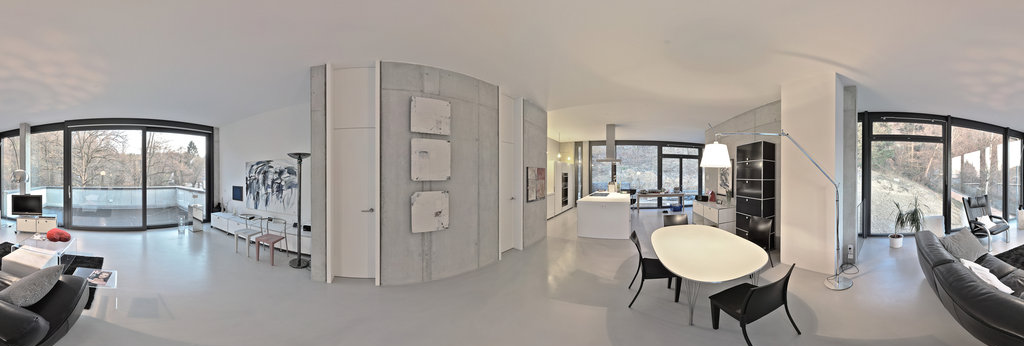
I want to click on pillow, so click(x=34, y=286).